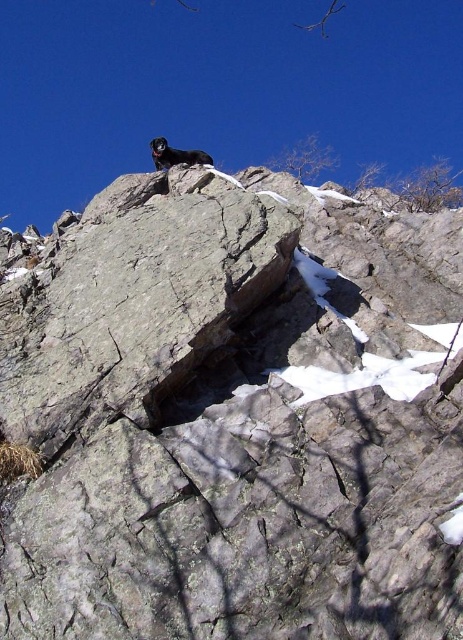
Question: Can you confirm if gray rough rock at upper center is bigger than black fur dog at upper center?

Choices:
 (A) no
 (B) yes

Answer: (A)

Question: Which object is farther from the camera taking this photo?

Choices:
 (A) gray rough rock at upper center
 (B) black fur dog at upper center

Answer: (B)

Question: Among these points, which one is farthest from the camera?

Choices:
 (A) (179, 218)
 (B) (156, 170)

Answer: (B)

Question: Observing the image, what is the correct spatial positioning of gray rough rock at upper center in reference to black fur dog at upper center?

Choices:
 (A) right
 (B) left

Answer: (A)

Question: Is gray rough rock at upper center bigger than black fur dog at upper center?

Choices:
 (A) no
 (B) yes

Answer: (A)